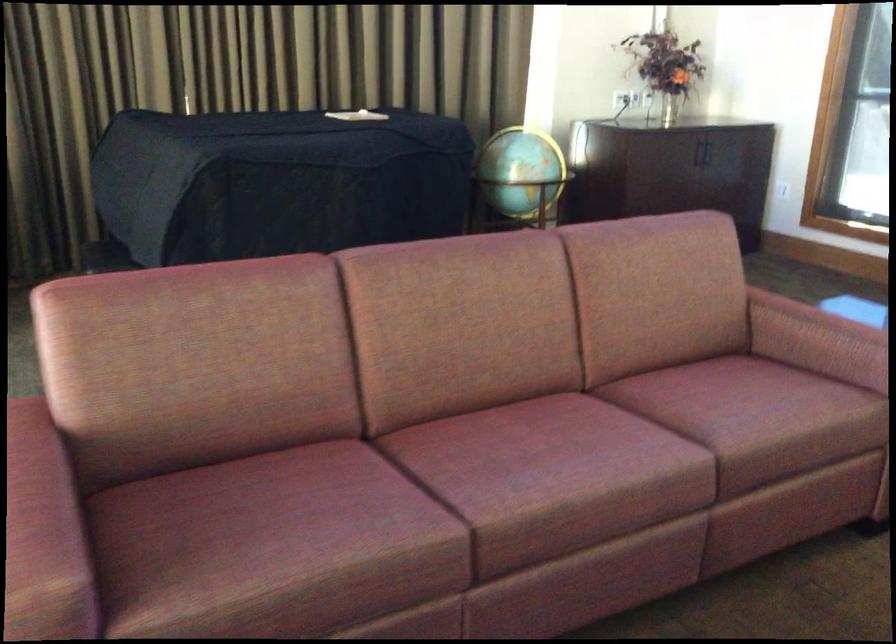
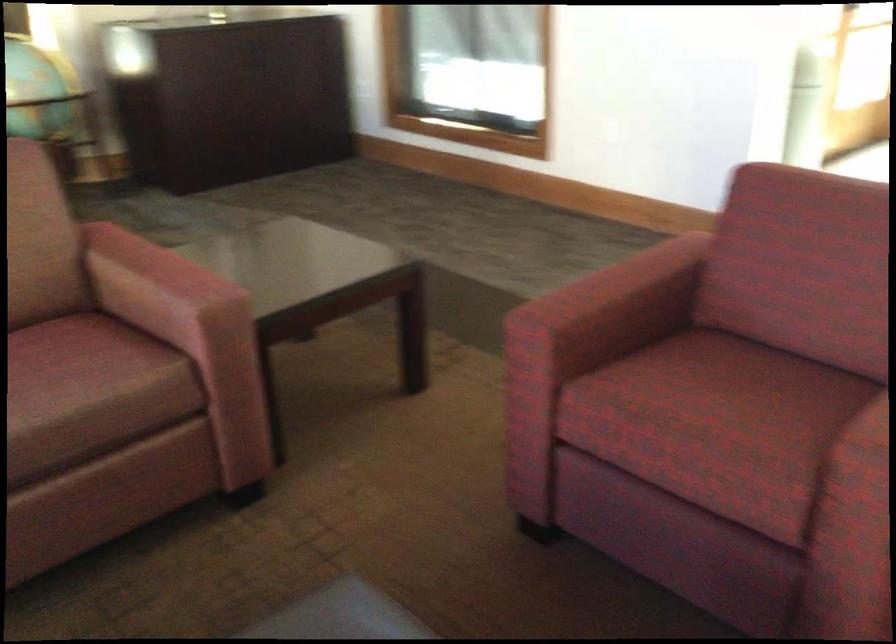
Question: The images are taken continuously from a first-person perspective. In which direction are you moving?

Choices:
 (A) Left
 (B) Right
 (C) Forward
 (D) Backward

Answer: (B)